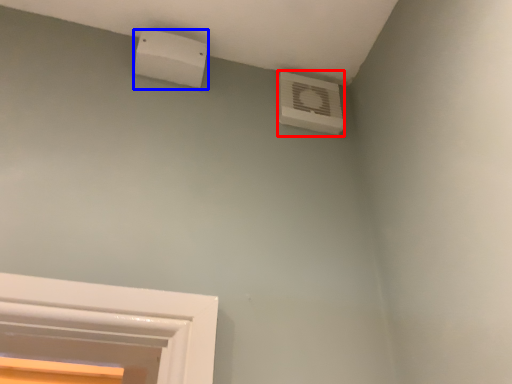
Question: Which point is closer to the camera, air conditioning (highlighted by a red box) or air conditioning (highlighted by a blue box)?

Choices:
 (A) air conditioning
 (B) air conditioning

Answer: (B)